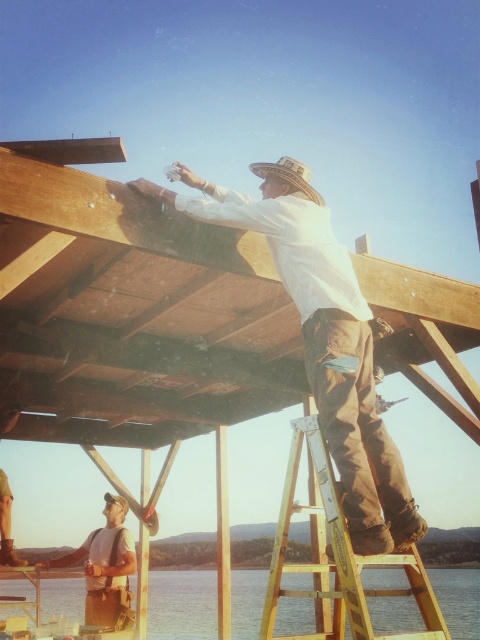
Does wooden ladder at center appear on the left side of tan canvas shirt at lower left?

Incorrect, wooden ladder at center is not on the left side of tan canvas shirt at lower left.

Is wooden ladder at center further to the viewer compared to tan canvas shirt at lower left?

No, wooden ladder at center is closer to the viewer.

Find the location of a particular element. wooden ladder at center is located at coordinates (336, 557).

Who is taller, wooden ladder at center or rustic straw cowboy hat at upper center?

With more height is wooden ladder at center.

Between point (340, 600) and point (259, 172), which one is positioned behind?

Point (259, 172)

At what (x,y) coordinates should I click in order to perform the action: click on wooden ladder at center. Please return your answer as a coordinate pair (x, y). Looking at the image, I should click on pyautogui.click(x=336, y=557).

Does tan canvas shirt at lower left appear on the right side of rustic straw cowboy hat at upper center?

In fact, tan canvas shirt at lower left is to the left of rustic straw cowboy hat at upper center.

Which of these two, tan canvas shirt at lower left or rustic straw cowboy hat at upper center, stands shorter?

Standing shorter between the two is rustic straw cowboy hat at upper center.

Who is more distant from viewer, (118, 509) or (305, 168)?

Point (118, 509)

This screenshot has height=640, width=480. I want to click on tan canvas shirt at lower left, so click(x=106, y=568).